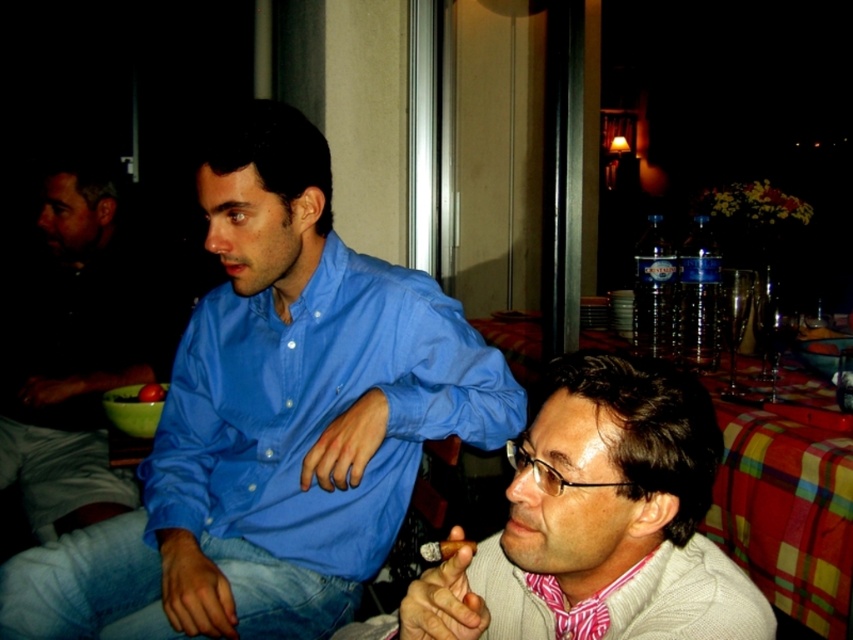
Who is more distant from viewer, (231,353) or (146,388)?

The point (146,388) is behind.

Between blue cotton shirt at center and smooth tomato at center, which one appears on the right side from the viewer's perspective?

blue cotton shirt at center

Who is more distant from viewer, (393, 360) or (149, 390)?

The point (149, 390) is more distant.

Where is `blue cotton shirt at center`? This screenshot has height=640, width=853. blue cotton shirt at center is located at coordinates (318, 410).

Can you confirm if blue smooth shirt at center is thinner than blue cotton shirt at center?

No, blue smooth shirt at center is not thinner than blue cotton shirt at center.

Is point (198, 196) positioned in front of point (151, 468)?

That is True.

Between point (247, 157) and point (379, 337), which one is positioned in front?

Point (247, 157) is more forward.

Locate an element on the screen. The image size is (853, 640). blue smooth shirt at center is located at coordinates (273, 422).

Does dark blue shirt at left appear under smooth tomato at center?

Actually, dark blue shirt at left is above smooth tomato at center.

Which is in front, point (77, 310) or point (160, 397)?

Point (160, 397) is more forward.

Find the location of a particular element. The image size is (853, 640). dark blue shirt at left is located at coordinates (80, 353).